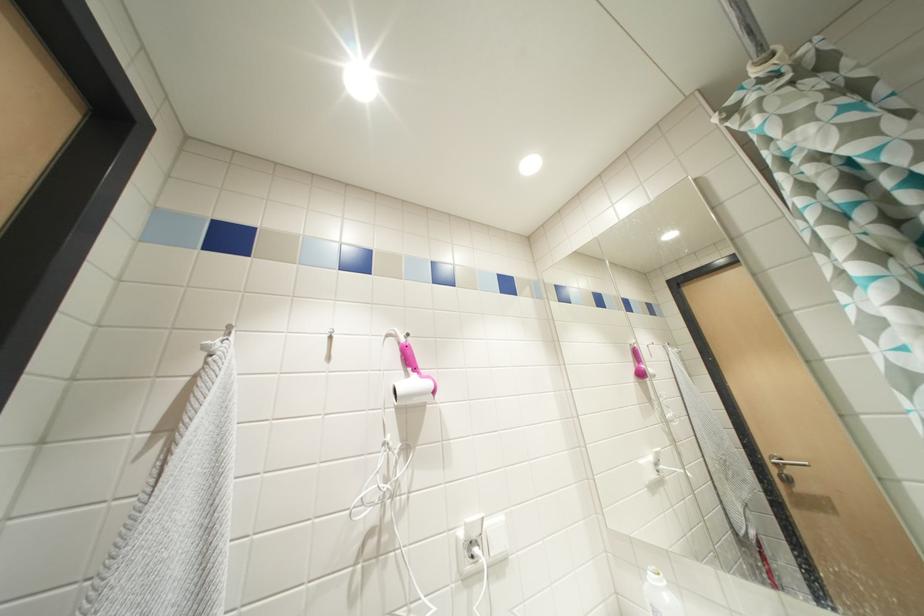
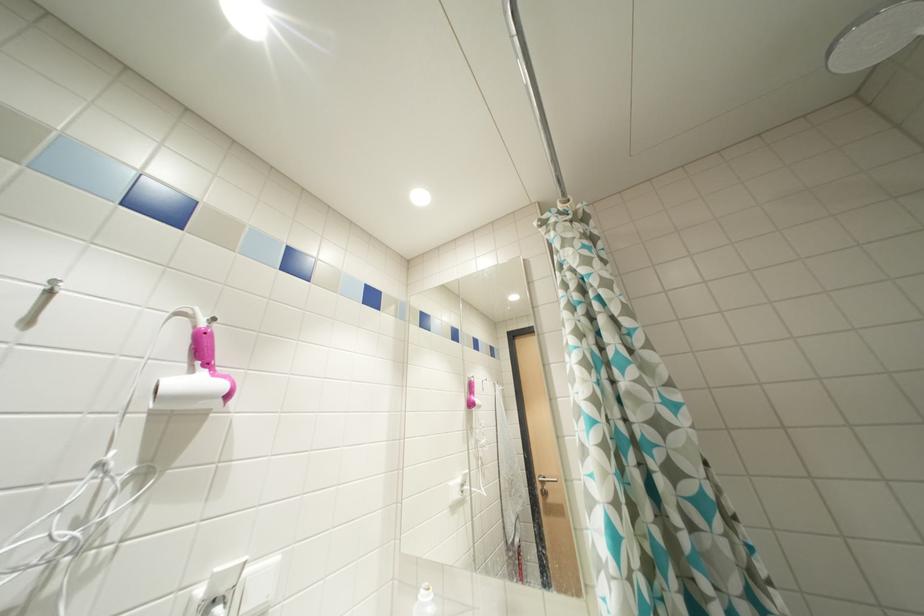
Question: The camera is either moving clockwise (left) or counter-clockwise (right) around the object. The first image is from the beginning of the video and the second image is from the end. Is the camera moving left or right when shooting the video?

Choices:
 (A) Left
 (B) Right

Answer: (A)